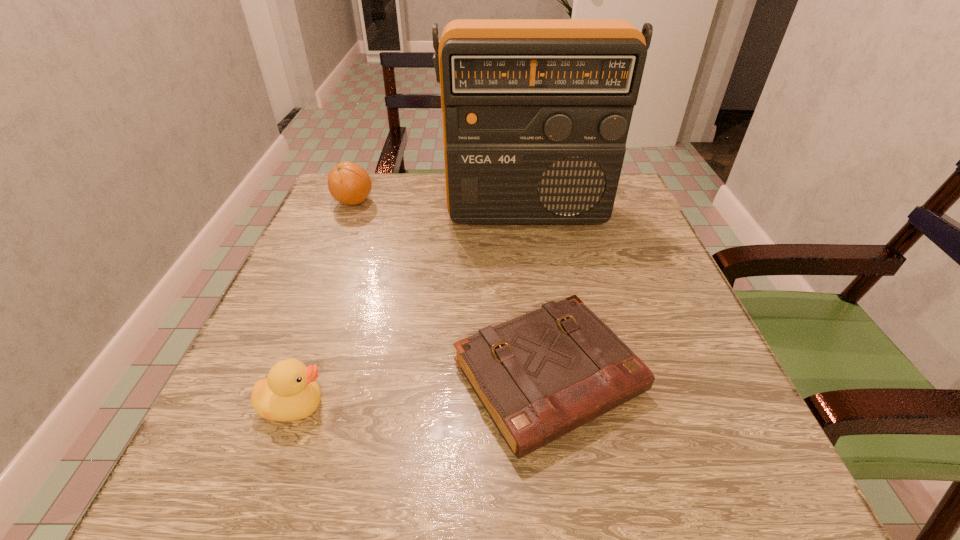
Where is `free space between the duck and the radio receiver`? The height and width of the screenshot is (540, 960). free space between the duck and the radio receiver is located at coordinates (410, 310).

In order to click on unoccupied position between the tallest object and the duck in this screenshot , I will do `click(410, 310)`.

Identify the location of unoccupied position between the duck and the shortest object. (421, 392).

Where is `vacant space that's between the duck and the shortest object`? Image resolution: width=960 pixels, height=540 pixels. vacant space that's between the duck and the shortest object is located at coordinates (421, 392).

Locate an element on the screen. The height and width of the screenshot is (540, 960). object that ranks as the second closest to the shortest object is located at coordinates (535, 112).

Point out which object is positioned as the nearest to the hardback book. Please provide its 2D coordinates. Your answer should be formatted as a tuple, i.e. [(x, y)], where the tuple contains the x and y coordinates of a point satisfying the conditions above.

[(290, 392)]

This screenshot has width=960, height=540. Find the location of `free space that satisfies the following two spatial constraints: 1. on the front-facing side of the tallest object; 2. at the beak of the duck`. free space that satisfies the following two spatial constraints: 1. on the front-facing side of the tallest object; 2. at the beak of the duck is located at coordinates (554, 406).

At what (x,y) coordinates should I click in order to perform the action: click on vacant space that satisfies the following two spatial constraints: 1. on the front side of the orange; 2. on the right side of the shortest object. Please return your answer as a coordinate pair (x, y). The height and width of the screenshot is (540, 960). Looking at the image, I should click on (281, 377).

This screenshot has width=960, height=540. In order to click on vacant region that satisfies the following two spatial constraints: 1. on the front-facing side of the radio receiver; 2. at the beak of the duck in this screenshot , I will do `click(554, 406)`.

Find the location of a particular element. The width and height of the screenshot is (960, 540). vacant space that satisfies the following two spatial constraints: 1. on the front-facing side of the tallest object; 2. at the beak of the duck is located at coordinates (554, 406).